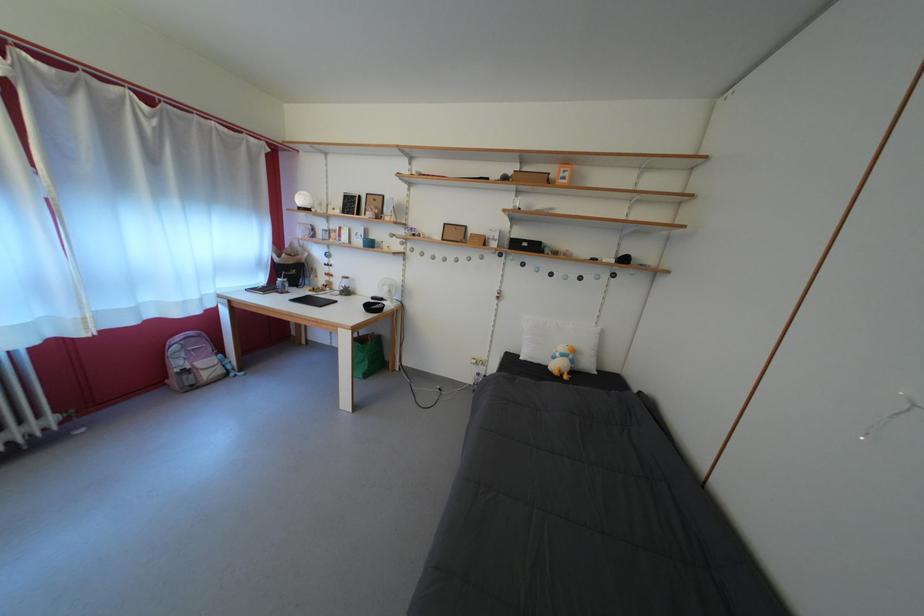
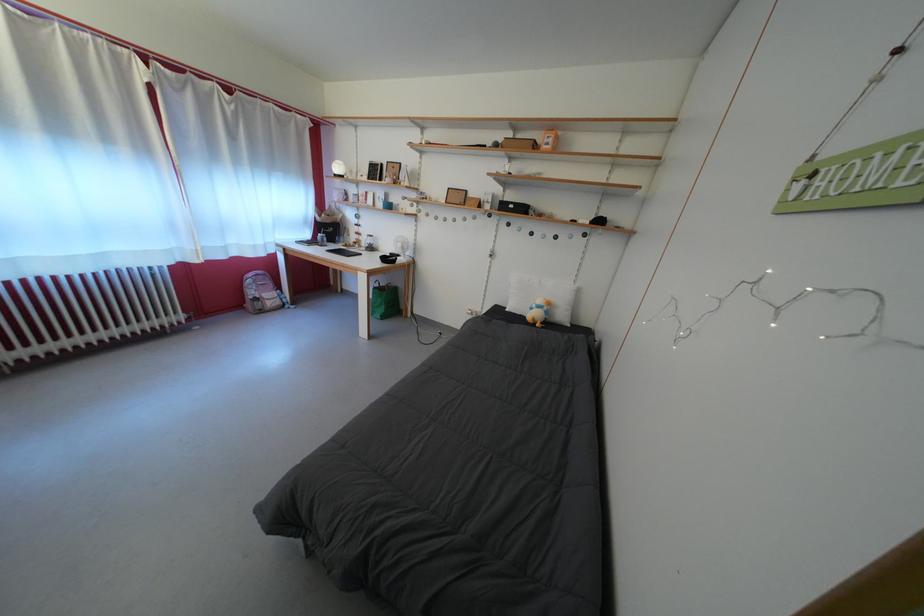
In the second image, find the point that corresponds to [565,361] in the first image.

(542, 312)